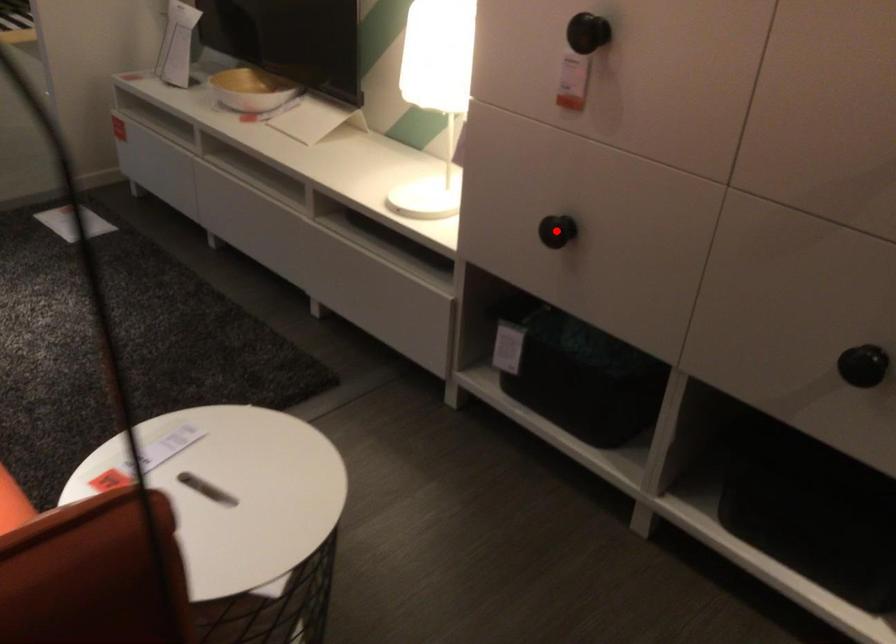
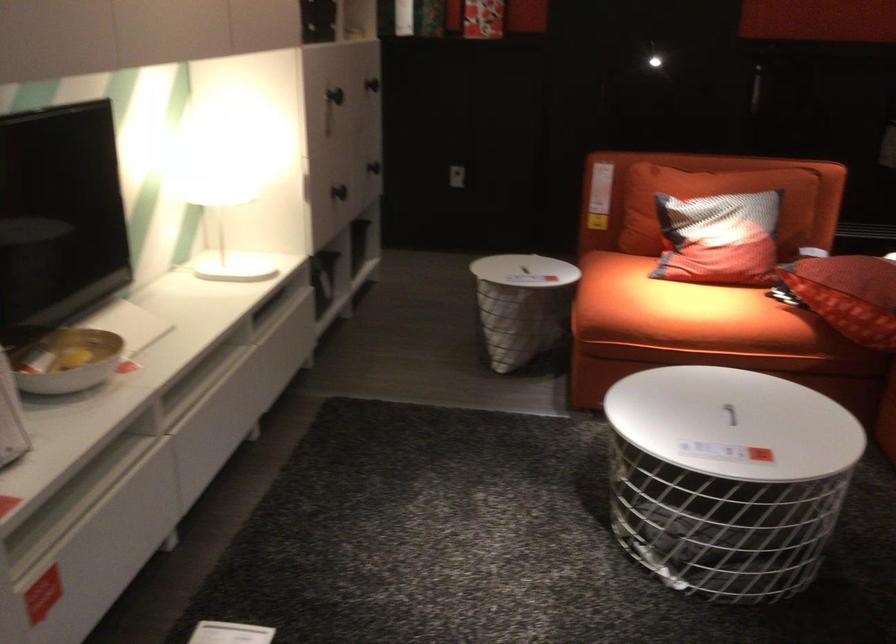
Question: I am providing you with two images of the same scene from different viewpoints. In image1, a red point is highlighted. Considering the same 3D point in image2, which of the following is correct?

Choices:
 (A) It is closer
 (B) It is farther

Answer: (B)